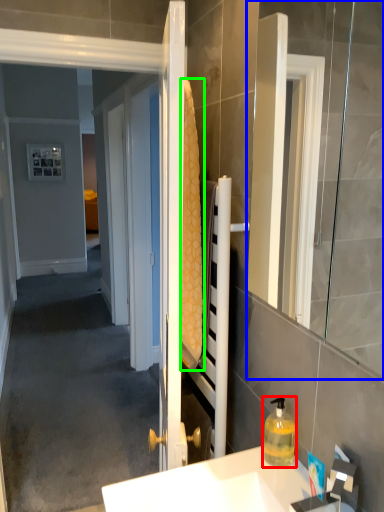
Question: Estimate the real-world distances between objects in this image. Which object is farther from bottle (highlighted by a red box), mirror (highlighted by a blue box) or bath towel (highlighted by a green box)?

Choices:
 (A) mirror
 (B) bath towel

Answer: (A)